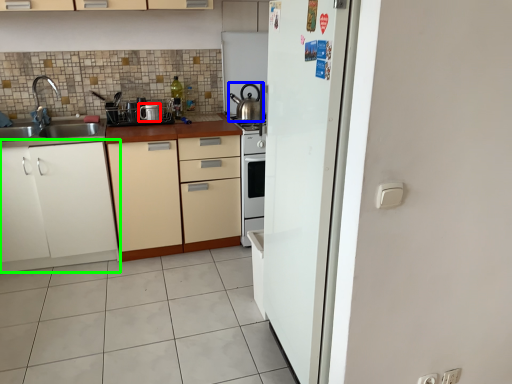
Question: Based on their relative distances, which object is farther from appliance (highlighted by a red box)? Choose from kitchen appliance (highlighted by a blue box) and cabinetry (highlighted by a green box).

Choices:
 (A) kitchen appliance
 (B) cabinetry

Answer: (B)